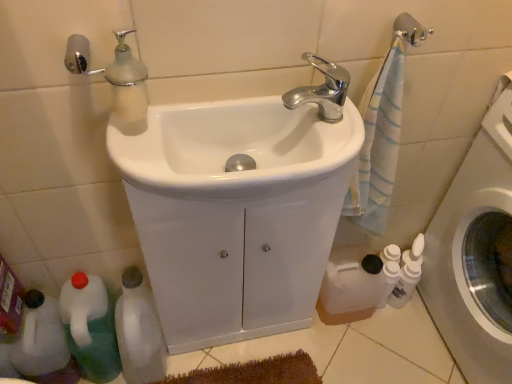
Question: Can you confirm if white glossy bottle at lower left, which is the 2th bottle from left to right, is thinner than white glossy sink at center, which ranks as the second sink in back-to-front order?

Choices:
 (A) no
 (B) yes

Answer: (B)

Question: From the image's perspective, would you say white glossy bottle at lower left, which is counted as the 2th bottle, starting from the right, is positioned over white glossy sink at center, acting as the first sink starting from the front?

Choices:
 (A) no
 (B) yes

Answer: (A)

Question: Is white glossy bottle at lower left, which is counted as the 2th bottle, starting from the right, to the right of white glossy sink at center, which ranks as the second sink in back-to-front order, from the viewer's perspective?

Choices:
 (A) yes
 (B) no

Answer: (B)

Question: Is white glossy bottle at lower left, which is counted as the 2th bottle, starting from the right, shorter than white glossy sink at center, which ranks as the second sink in back-to-front order?

Choices:
 (A) yes
 (B) no

Answer: (B)

Question: Does white glossy bottle at lower left, which is the 2th bottle from left to right, have a greater width compared to white glossy sink at center, acting as the first sink starting from the front?

Choices:
 (A) yes
 (B) no

Answer: (B)

Question: In the image, is silver metallic towel bar at upper right on the left side or the right side of chrome metallic faucet at upper center?

Choices:
 (A) right
 (B) left

Answer: (A)

Question: Is silver metallic towel bar at upper right taller or shorter than chrome metallic faucet at upper center?

Choices:
 (A) tall
 (B) short

Answer: (B)

Question: Considering the positions of silver metallic towel bar at upper right and chrome metallic faucet at upper center in the image, is silver metallic towel bar at upper right wider or thinner than chrome metallic faucet at upper center?

Choices:
 (A) wide
 (B) thin

Answer: (B)

Question: Considering the positions of silver metallic towel bar at upper right and chrome metallic faucet at upper center in the image, is silver metallic towel bar at upper right bigger or smaller than chrome metallic faucet at upper center?

Choices:
 (A) big
 (B) small

Answer: (B)

Question: Is point (390, 266) closer or farther from the camera than point (343, 119)?

Choices:
 (A) farther
 (B) closer

Answer: (A)

Question: Considering their positions, is white matte bottle at lower right, acting as the first bottle starting from the right, located in front of or behind white glossy sink at center, acting as the first sink starting from the front?

Choices:
 (A) front
 (B) behind

Answer: (B)

Question: From a real-world perspective, is white matte bottle at lower right, the third bottle from the left, positioned above or below white glossy sink at center, acting as the first sink starting from the front?

Choices:
 (A) above
 (B) below

Answer: (B)

Question: Is white matte bottle at lower right, acting as the first bottle starting from the right, taller or shorter than white glossy sink at center, acting as the first sink starting from the front?

Choices:
 (A) tall
 (B) short

Answer: (A)

Question: Is point (31, 344) closer or farther from the camera than point (81, 322)?

Choices:
 (A) farther
 (B) closer

Answer: (B)

Question: Relative to white plastic bottle at lower left, the 3th bottle in the right-to-left sequence, is white plastic bottle at lower left in front or behind?

Choices:
 (A) front
 (B) behind

Answer: (B)